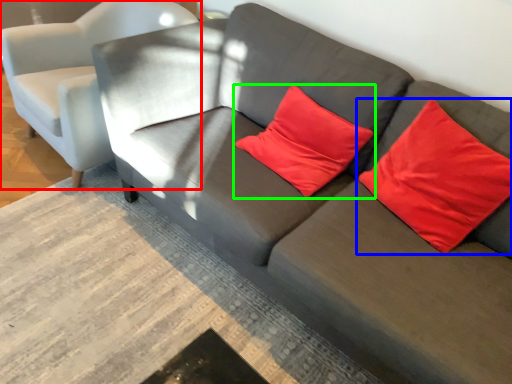
Question: Estimate the real-world distances between objects in this image. Which object is farther from chair (highlighted by a red box), pillow (highlighted by a blue box) or pillow (highlighted by a green box)?

Choices:
 (A) pillow
 (B) pillow

Answer: (A)